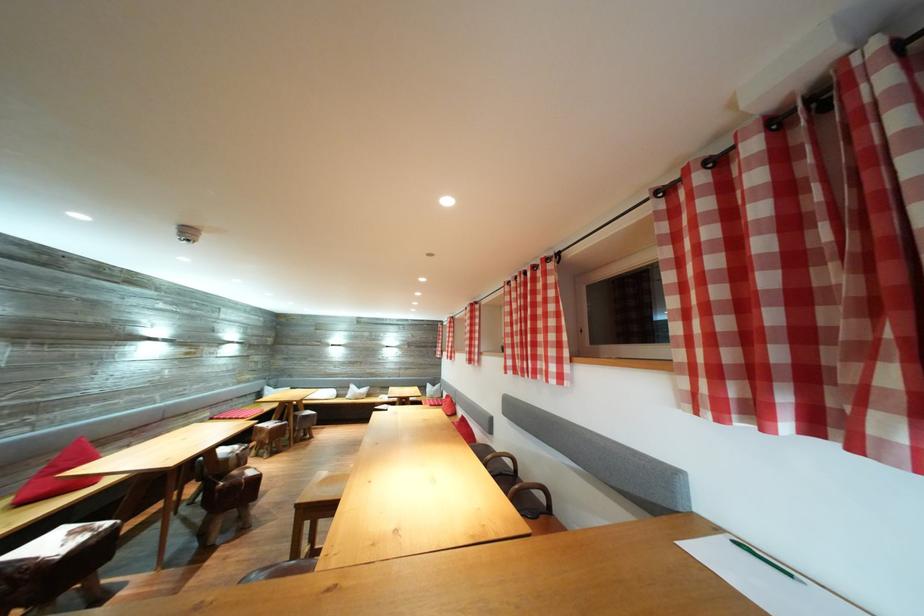
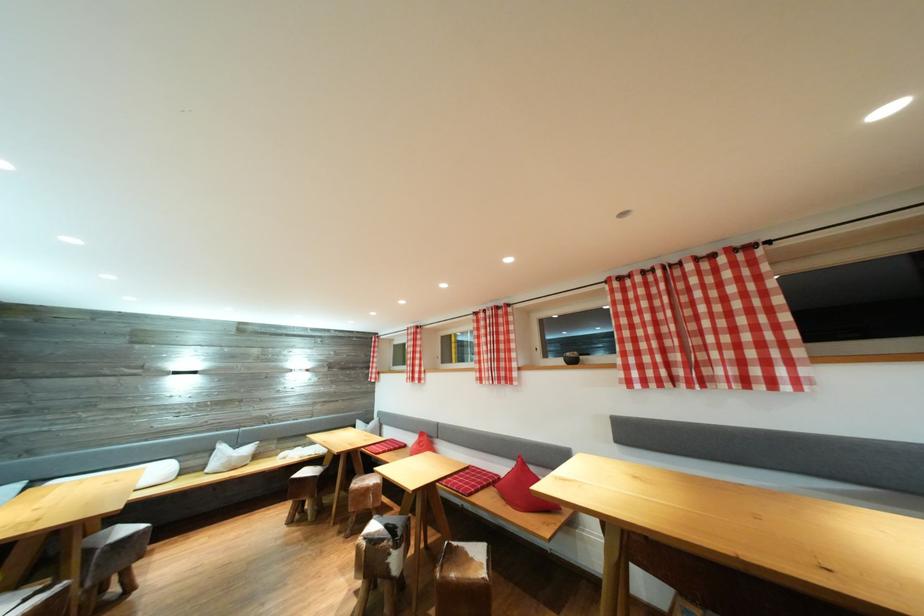
Find the pixel in the second image that matches (x=359, y=392) in the first image.

(228, 453)